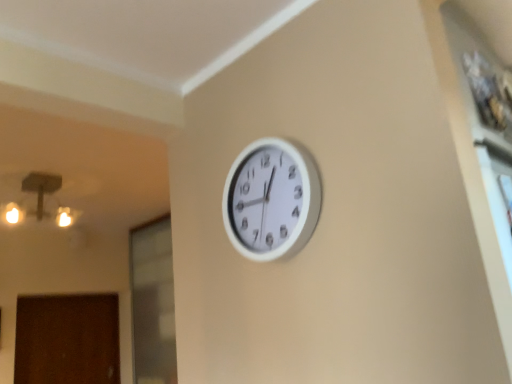
Question: Could you tell me if white plastic clock at upper center is facing brown matte door at lower left?

Choices:
 (A) yes
 (B) no

Answer: (B)

Question: Is white plastic clock at upper center positioned behind brown matte door at lower left?

Choices:
 (A) yes
 (B) no

Answer: (B)

Question: Considering the relative sizes of white plastic clock at upper center and brown matte door at lower left in the image provided, is white plastic clock at upper center taller than brown matte door at lower left?

Choices:
 (A) yes
 (B) no

Answer: (B)

Question: Are white plastic clock at upper center and brown matte door at lower left far apart?

Choices:
 (A) yes
 (B) no

Answer: (A)

Question: From the image's perspective, is white plastic clock at upper center located above brown matte door at lower left?

Choices:
 (A) yes
 (B) no

Answer: (A)

Question: In terms of height, does transparent glass door at lower left look taller or shorter compared to brown matte door at lower left?

Choices:
 (A) short
 (B) tall

Answer: (B)

Question: In the image, is transparent glass door at lower left positioned in front of or behind brown matte door at lower left?

Choices:
 (A) front
 (B) behind

Answer: (A)

Question: Considering the relative positions of transparent glass door at lower left and brown matte door at lower left in the image provided, is transparent glass door at lower left to the left or to the right of brown matte door at lower left?

Choices:
 (A) right
 (B) left

Answer: (A)

Question: Looking at the image, does transparent glass door at lower left seem bigger or smaller compared to brown matte door at lower left?

Choices:
 (A) big
 (B) small

Answer: (A)

Question: In the image, is white plastic clock at upper center positioned in front of or behind brown matte door at lower left?

Choices:
 (A) behind
 (B) front

Answer: (B)

Question: In terms of height, does white plastic clock at upper center look taller or shorter compared to brown matte door at lower left?

Choices:
 (A) tall
 (B) short

Answer: (B)

Question: Visually, is white plastic clock at upper center positioned to the left or to the right of brown matte door at lower left?

Choices:
 (A) left
 (B) right

Answer: (B)

Question: From a real-world perspective, is white plastic clock at upper center positioned above or below brown matte door at lower left?

Choices:
 (A) below
 (B) above

Answer: (B)

Question: Looking at the image, does brown matte door at lower left seem bigger or smaller compared to white plastic clock at upper center?

Choices:
 (A) big
 (B) small

Answer: (A)

Question: Would you say brown matte door at lower left is inside or outside white plastic clock at upper center?

Choices:
 (A) outside
 (B) inside

Answer: (A)